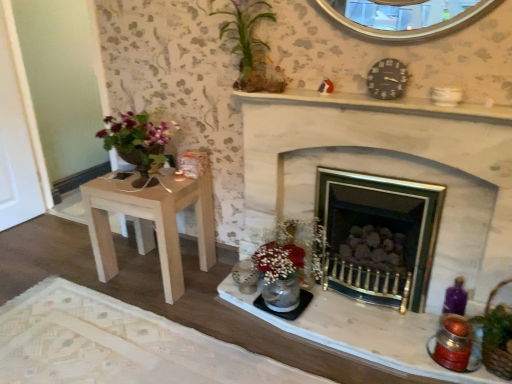
Question: Is black plastic clock at upper right taller or shorter than white marble mantel at upper center?

Choices:
 (A) tall
 (B) short

Answer: (A)

Question: Would you say black plastic clock at upper right is inside or outside white marble mantel at upper center?

Choices:
 (A) inside
 (B) outside

Answer: (B)

Question: Which of these objects is positioned farthest from the white stone fireplace at center?

Choices:
 (A) light brown wood table at left
 (B) green leafy plant at upper center
 (C) brown woven basket at lower right
 (D) shiny metallic candle holder at lower right, which ranks as the second candle holder in back-to-front order
 (E) matte silver candle holder at lower center, the 2th candle holder when ordered from front to back

Answer: (A)

Question: Which is nearer to the light brown wood table at left?

Choices:
 (A) white stone fireplace at center
 (B) green leafy plant at upper center
 (C) brown woven basket at lower right
 (D) shiny metallic candle holder at lower right, which ranks as the second candle holder in back-to-front order
 (E) white marble mantel at upper center

Answer: (A)